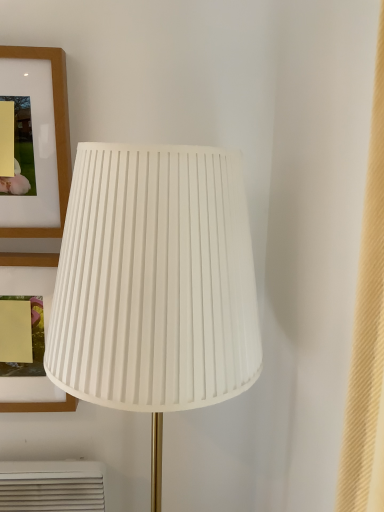
Question: Is white pleated fabric lampshade at center to the left of matte wood picture frame at upper left, which is the first picture frame from top to bottom, from the viewer's perspective?

Choices:
 (A) no
 (B) yes

Answer: (A)

Question: From the image's perspective, would you say white pleated fabric lampshade at center is shown under matte wood picture frame at upper left, placed as the second picture frame when sorted from bottom to top?

Choices:
 (A) no
 (B) yes

Answer: (B)

Question: Does white pleated fabric lampshade at center have a larger size compared to matte wood picture frame at upper left, which is the first picture frame from top to bottom?

Choices:
 (A) no
 (B) yes

Answer: (B)

Question: Is white pleated fabric lampshade at center at the right side of matte wood picture frame at upper left, placed as the second picture frame when sorted from bottom to top?

Choices:
 (A) yes
 (B) no

Answer: (A)

Question: From a real-world perspective, is white pleated fabric lampshade at center located higher than matte wood picture frame at upper left, placed as the second picture frame when sorted from bottom to top?

Choices:
 (A) no
 (B) yes

Answer: (A)

Question: Is white pleated fabric lampshade at center next to matte wood picture frame at upper left, which is the first picture frame from top to bottom?

Choices:
 (A) no
 (B) yes

Answer: (A)

Question: Can you confirm if matte wood picture frame at upper left, arranged as the 2th picture frame when viewed from the top, is wider than white pleated fabric lampshade at center?

Choices:
 (A) no
 (B) yes

Answer: (A)

Question: Considering the relative sizes of matte wood picture frame at upper left, arranged as the 2th picture frame when viewed from the top, and white pleated fabric lampshade at center in the image provided, is matte wood picture frame at upper left, arranged as the 2th picture frame when viewed from the top, taller than white pleated fabric lampshade at center?

Choices:
 (A) yes
 (B) no

Answer: (B)

Question: Does matte wood picture frame at upper left, arranged as the 2th picture frame when viewed from the top, have a larger size compared to white pleated fabric lampshade at center?

Choices:
 (A) no
 (B) yes

Answer: (A)

Question: Is matte wood picture frame at upper left, arranged as the 2th picture frame when viewed from the top, positioned behind white pleated fabric lampshade at center?

Choices:
 (A) yes
 (B) no

Answer: (A)

Question: From a real-world perspective, is matte wood picture frame at upper left, arranged as the 2th picture frame when viewed from the top, under white pleated fabric lampshade at center?

Choices:
 (A) yes
 (B) no

Answer: (B)

Question: Is matte wood picture frame at upper left, positioned as the 1th picture frame in bottom-to-top order, next to white pleated fabric lampshade at center and touching it?

Choices:
 (A) no
 (B) yes

Answer: (A)

Question: Considering the relative sizes of matte wood picture frame at upper left, arranged as the 2th picture frame when viewed from the top, and matte wood picture frame at upper left, which is the first picture frame from top to bottom, in the image provided, is matte wood picture frame at upper left, arranged as the 2th picture frame when viewed from the top, taller than matte wood picture frame at upper left, which is the first picture frame from top to bottom,?

Choices:
 (A) no
 (B) yes

Answer: (B)